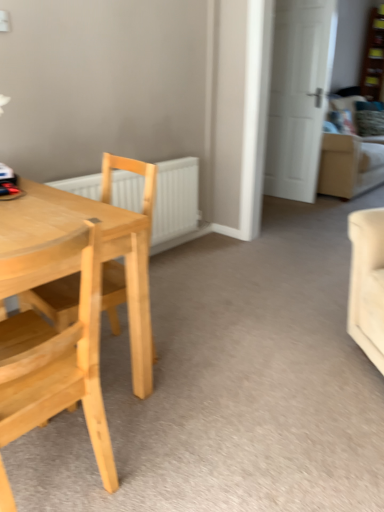
Question: Relative to wooden bookshelf at upper right, is natural wood chair at left, which is the second chair in front-to-back order, in front or behind?

Choices:
 (A) behind
 (B) front

Answer: (B)

Question: Does point 49,309 appear closer or farther from the camera than point 377,31?

Choices:
 (A) farther
 (B) closer

Answer: (B)

Question: Which is nearer to the white matte door at upper right?

Choices:
 (A) white matte radiator at center
 (B) light wood chair at left, the 1th chair from the front
 (C) beige fabric couch at upper right
 (D) natural wood chair at left, positioned as the 1th chair in back-to-front order
 (E) wooden bookshelf at upper right

Answer: (C)

Question: Estimate the real-world distances between objects in this image. Which object is farther from the white matte radiator at center?

Choices:
 (A) white matte door at upper right
 (B) light wood chair at left, the 1th chair from the front
 (C) natural wood chair at left, positioned as the 1th chair in back-to-front order
 (D) beige fabric couch at upper right
 (E) wooden bookshelf at upper right

Answer: (E)